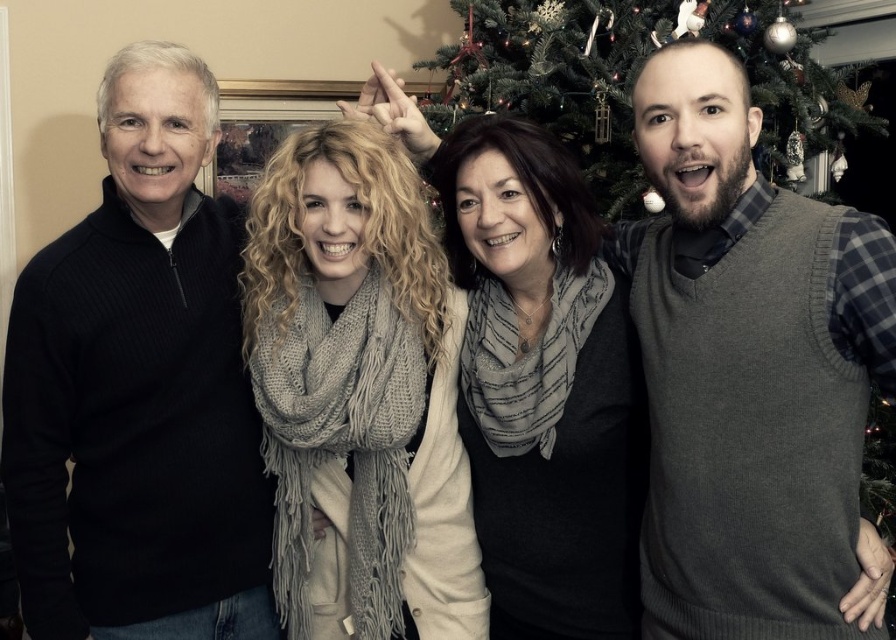
Does black sweater at left appear under knitted scarf at center?

Actually, black sweater at left is above knitted scarf at center.

Image resolution: width=896 pixels, height=640 pixels. What are the coordinates of `black sweater at left` in the screenshot? It's located at (138, 388).

Where is `black sweater at left`? black sweater at left is located at coordinates (138, 388).

Is knitted scarf at center closer to the viewer compared to gray scarf at center?

Yes.

Can you confirm if knitted scarf at center is shorter than gray scarf at center?

No.

Between point (440, 540) and point (505, 419), which one is positioned behind?

Positioned behind is point (440, 540).

Find the location of a particular element. knitted scarf at center is located at coordinates (359, 392).

Can you confirm if knitted scarf at center is wider than green textured christmas tree at upper center?

No, knitted scarf at center is not wider than green textured christmas tree at upper center.

Which is below, knitted scarf at center or green textured christmas tree at upper center?

knitted scarf at center

Find the location of a particular element. The width and height of the screenshot is (896, 640). knitted scarf at center is located at coordinates (359, 392).